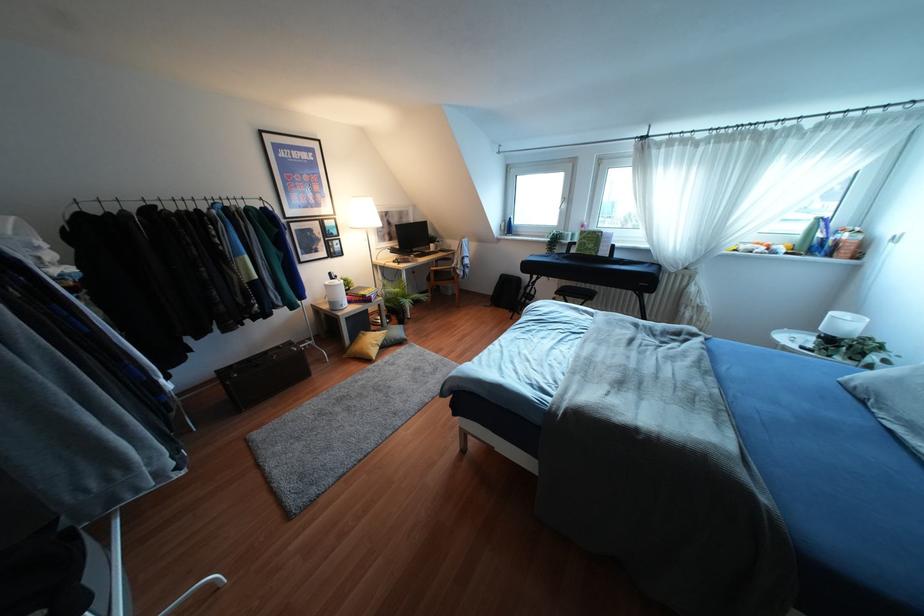
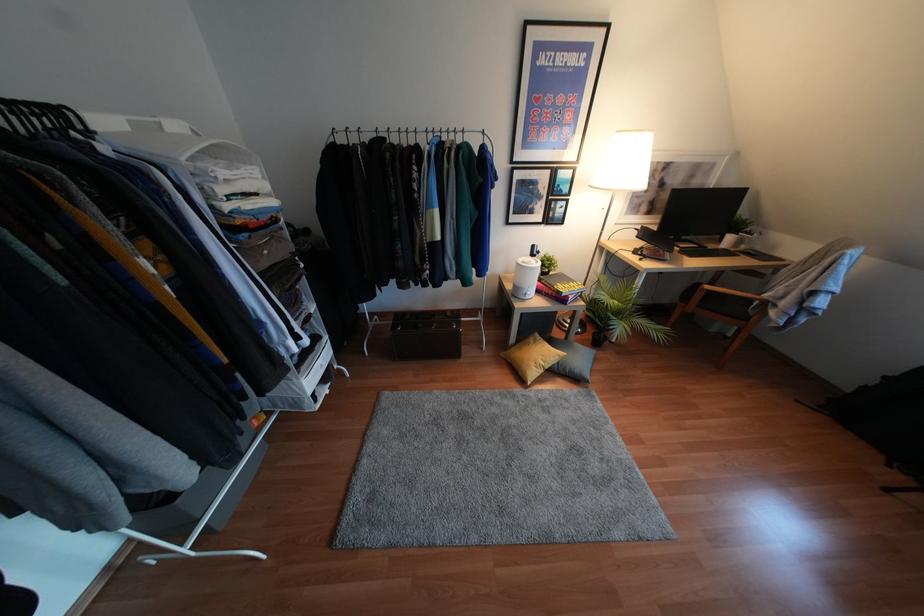
The images are taken continuously from a first-person perspective. In which direction is your viewpoint rotating?

The camera rotated toward left-down.